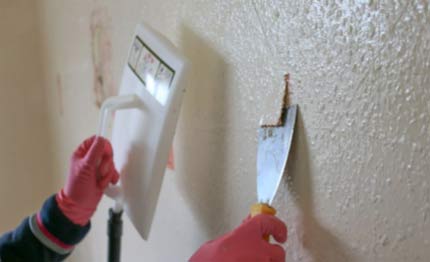
This screenshot has height=262, width=430. What are the coordinates of `metal paint scraper` in the screenshot? It's located at (x=274, y=156).